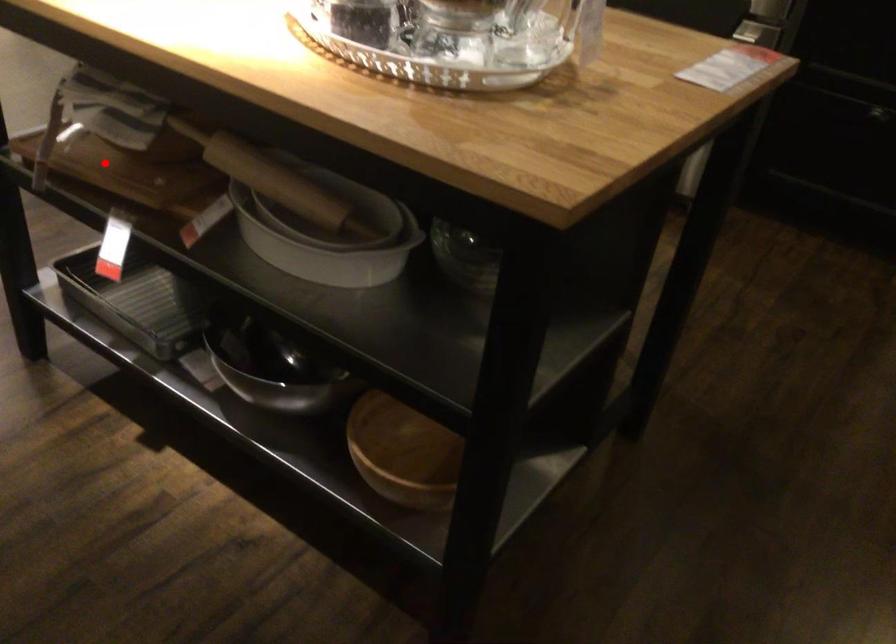
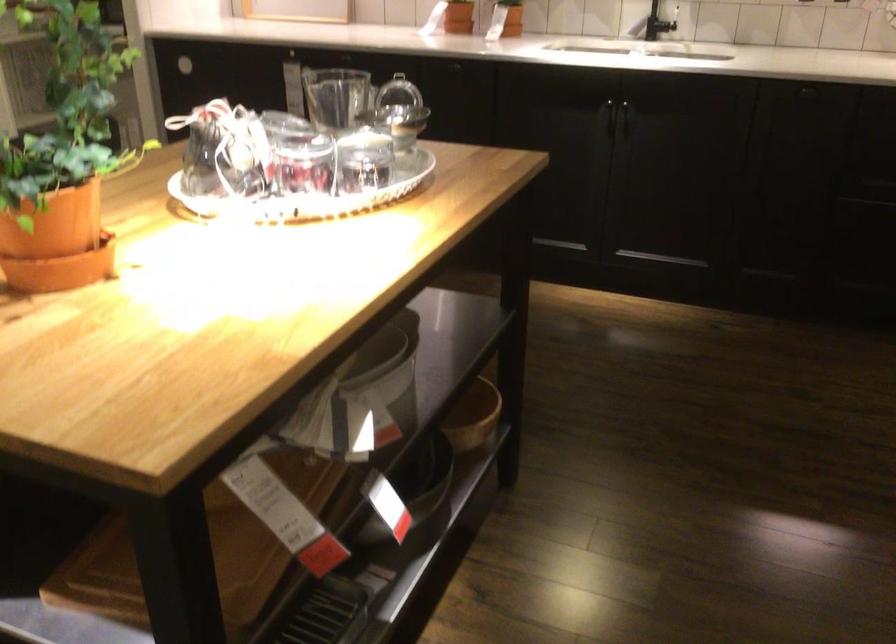
Locate, in the second image, the point that corresponds to the highlighted location in the first image.

(362, 397)